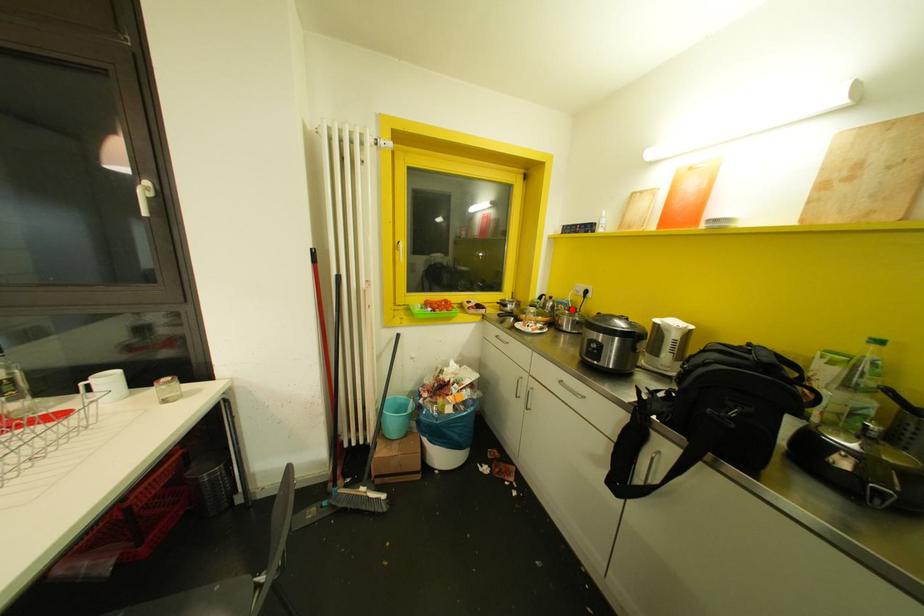
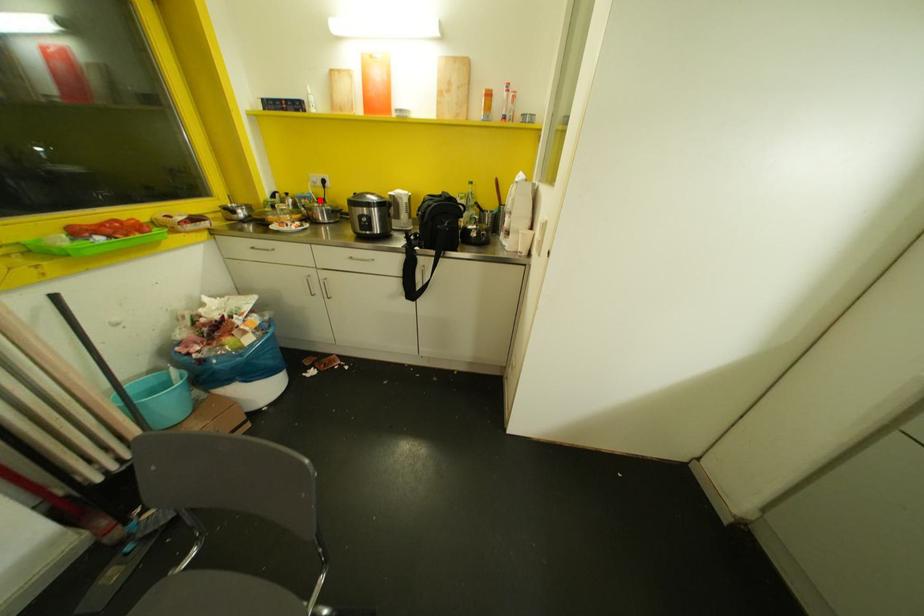
I am providing you with two images of the same scene from different viewpoints. A red point is marked on the first image and another point is marked on the second image. Is the marked point in image1 the same physical position as the marked point in image2?

Yes